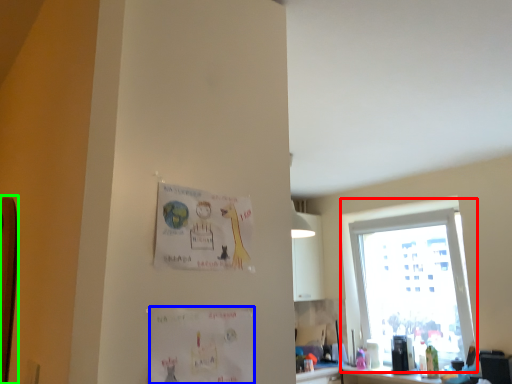
Question: Based on their relative distances, which object is nearer to window (highlighted by a red box)? Choose from postcard (highlighted by a blue box) and bulletin board (highlighted by a green box).

Choices:
 (A) postcard
 (B) bulletin board

Answer: (A)